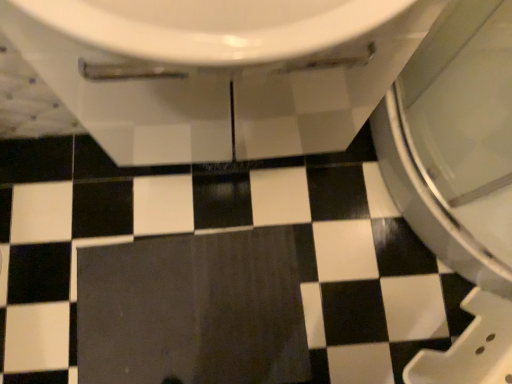
Question: Can you confirm if white glossy toilet at upper center is thinner than dark matte tile at center?

Choices:
 (A) no
 (B) yes

Answer: (B)

Question: Does white glossy toilet at upper center have a greater width compared to dark matte tile at center?

Choices:
 (A) yes
 (B) no

Answer: (B)

Question: Can you confirm if white glossy toilet at upper center is smaller than dark matte tile at center?

Choices:
 (A) no
 (B) yes

Answer: (A)

Question: Are white glossy toilet at upper center and dark matte tile at center beside each other?

Choices:
 (A) yes
 (B) no

Answer: (B)

Question: Is white glossy toilet at upper center to the left of dark matte tile at center from the viewer's perspective?

Choices:
 (A) no
 (B) yes

Answer: (A)

Question: From the image's perspective, would you say white glossy toilet at upper center is positioned over dark matte tile at center?

Choices:
 (A) yes
 (B) no

Answer: (A)

Question: Is dark matte tile at center located outside white glossy toilet at upper center?

Choices:
 (A) yes
 (B) no

Answer: (A)

Question: From the image's perspective, is dark matte tile at center above white glossy toilet at upper center?

Choices:
 (A) yes
 (B) no

Answer: (B)

Question: Would you say dark matte tile at center is a long distance from white glossy toilet at upper center?

Choices:
 (A) no
 (B) yes

Answer: (A)

Question: Is dark matte tile at center touching white glossy toilet at upper center?

Choices:
 (A) no
 (B) yes

Answer: (A)

Question: Considering the relative sizes of dark matte tile at center and white glossy toilet at upper center in the image provided, is dark matte tile at center wider than white glossy toilet at upper center?

Choices:
 (A) yes
 (B) no

Answer: (A)

Question: Is dark matte tile at center to the right of white glossy toilet at upper center from the viewer's perspective?

Choices:
 (A) yes
 (B) no

Answer: (B)

Question: Considering the positions of white glossy toilet at upper center and dark matte tile at center in the image, is white glossy toilet at upper center bigger or smaller than dark matte tile at center?

Choices:
 (A) small
 (B) big

Answer: (B)